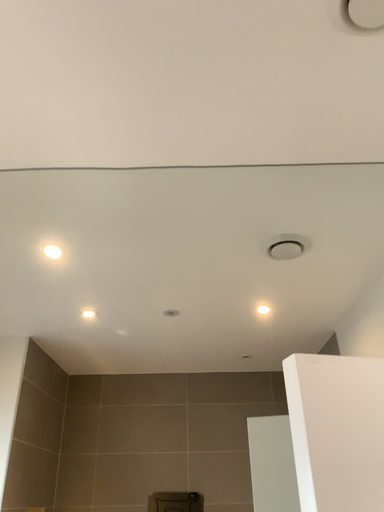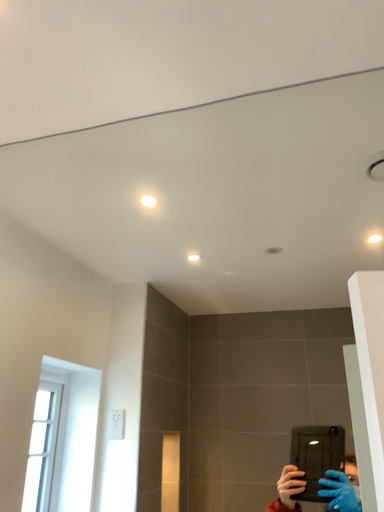
Question: How did the camera likely rotate when shooting the video?

Choices:
 (A) rotated downward
 (B) rotated upward

Answer: (A)